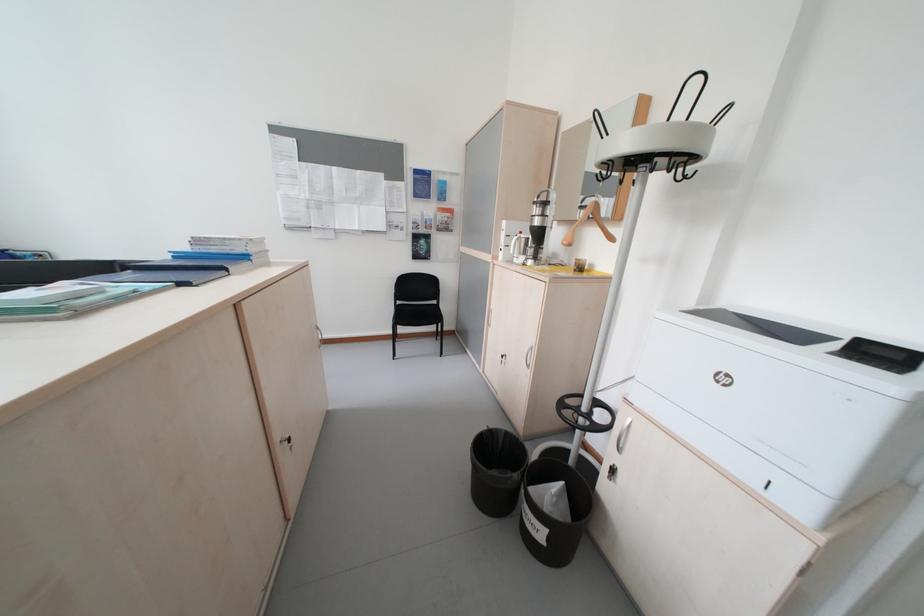
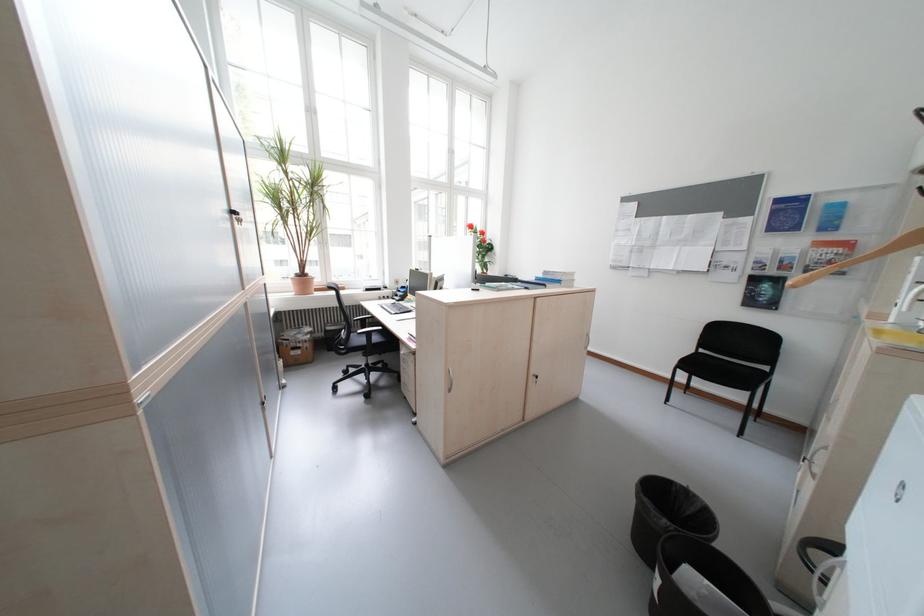
In the second image, find the point that corresponds to point 463,220 in the first image.

(859, 257)